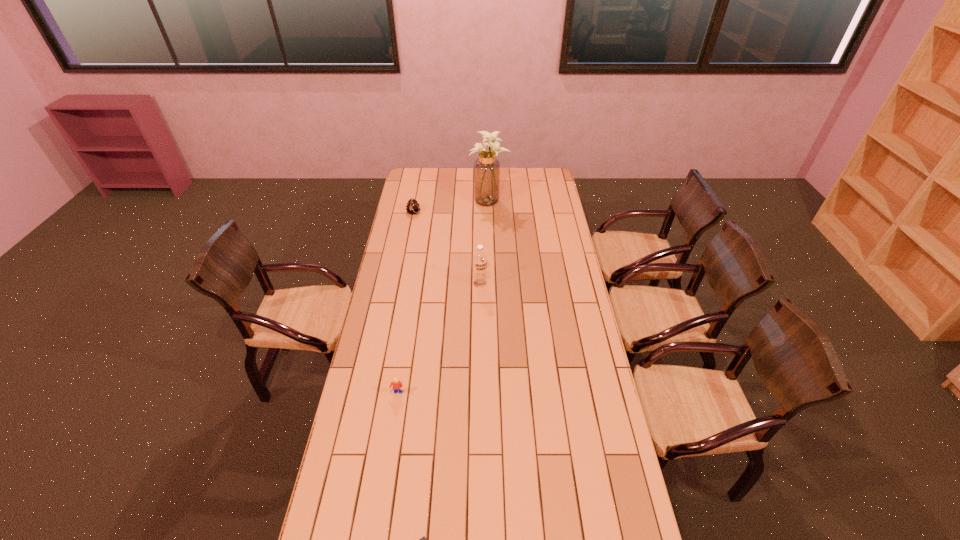
Locate an element on the screen. Lego positioned at the left edge is located at coordinates (397, 385).

In the image, there is a desktop. Where is `vacant region at the left edge`? vacant region at the left edge is located at coordinates (413, 214).

In the image, there is a desktop. In order to click on vacant space at the right edge in this screenshot , I will do `click(548, 248)`.

This screenshot has height=540, width=960. I want to click on vacant area that lies between the fourth farthest object and the flower arrangement, so click(443, 297).

Find the location of a particular element. free space between the vodka and the tallest object is located at coordinates point(485,242).

At what (x,y) coordinates should I click in order to perform the action: click on object that is the second nearest to the pinecone. Please return your answer as a coordinate pair (x, y). The width and height of the screenshot is (960, 540). Looking at the image, I should click on (480, 259).

Identify the location of object that stands as the second closest to the flower arrangement. (480, 259).